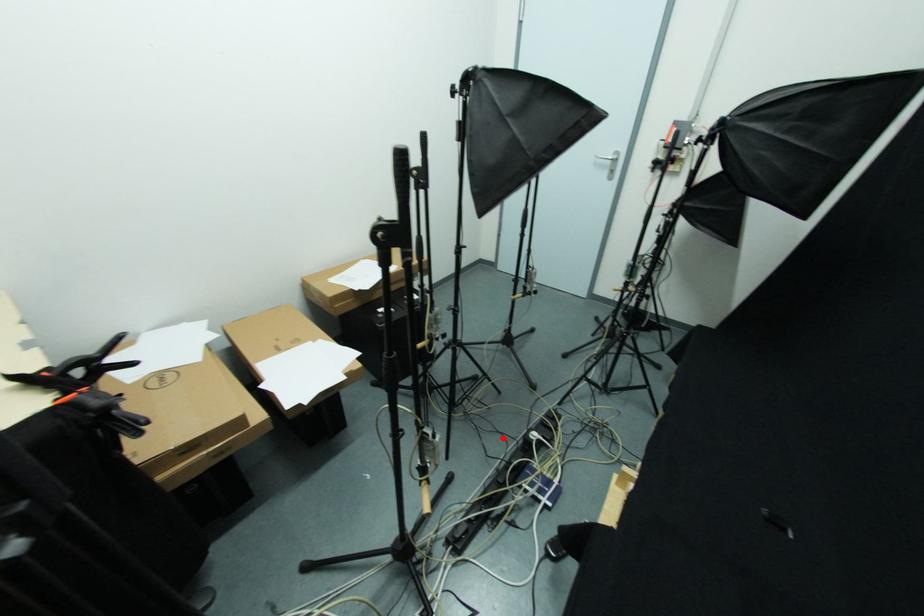
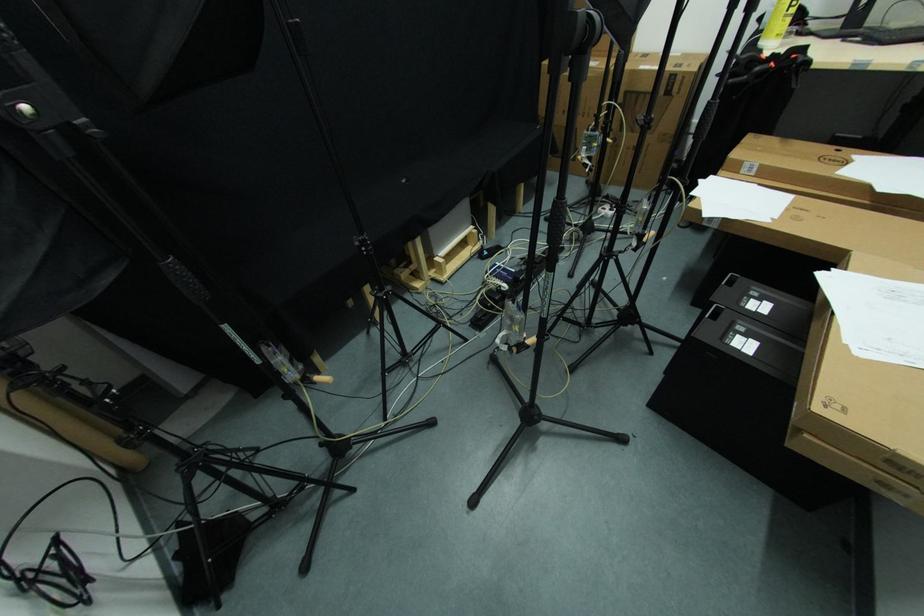
Locate, in the second image, the point that corresponds to the highlighted location in the first image.

(535, 310)